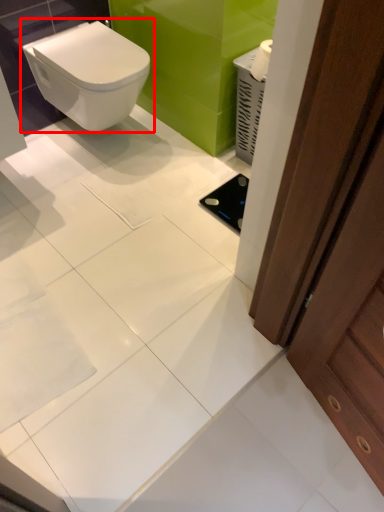
Question: From the image, what is the correct spatial relationship of toilet (annotated by the red box) in relation to screen door?

Choices:
 (A) right
 (B) left

Answer: (B)